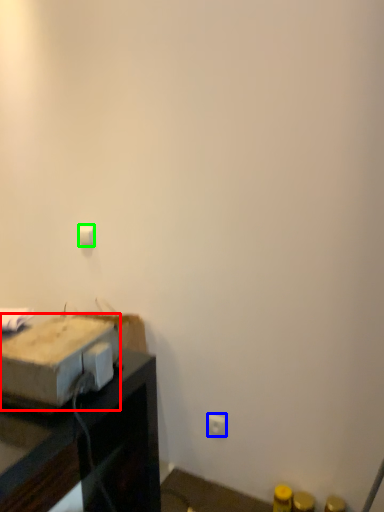
Question: Which object is positioned farthest from cardboard box (highlighted by a red box)? Select from electric outlet (highlighted by a blue box) and light switch (highlighted by a green box).

Choices:
 (A) electric outlet
 (B) light switch

Answer: (A)